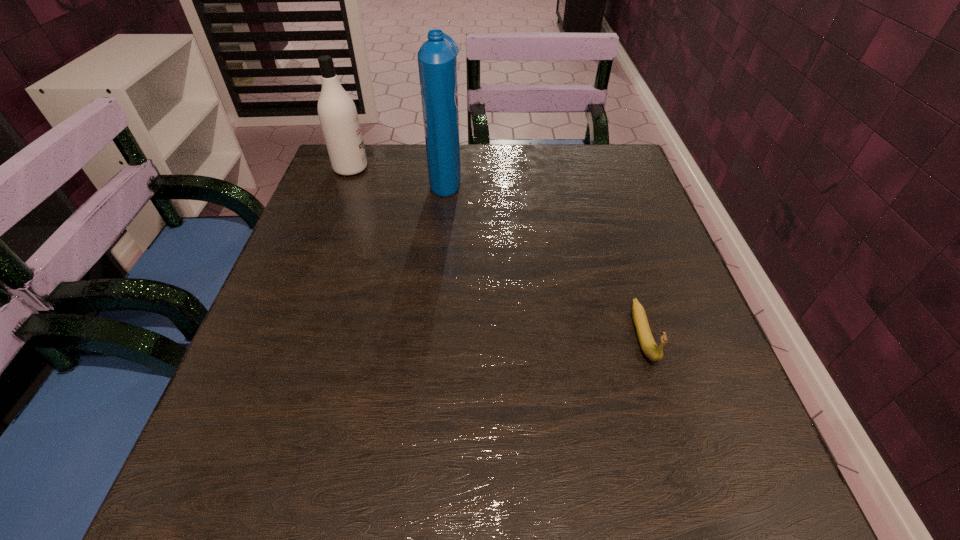
Image resolution: width=960 pixels, height=540 pixels. I want to click on the second object from left to right, so click(437, 62).

Where is `the right shampoo`? the right shampoo is located at coordinates (437, 62).

The image size is (960, 540). I want to click on the shorter shampoo, so click(x=338, y=116).

This screenshot has width=960, height=540. Identify the location of the left shampoo. (338, 116).

Locate an element on the screen. the rightmost object is located at coordinates (653, 352).

Locate an element on the screen. The height and width of the screenshot is (540, 960). the shortest object is located at coordinates (653, 352).

The height and width of the screenshot is (540, 960). Find the location of `blank space located 0.280m on the right of the tallest object`. blank space located 0.280m on the right of the tallest object is located at coordinates (572, 174).

At what (x,y) coordinates should I click in order to perform the action: click on blank space located on the front-facing side of the shorter shampoo. Please return your answer as a coordinate pair (x, y). This screenshot has height=540, width=960. Looking at the image, I should click on (484, 168).

The image size is (960, 540). Identify the location of blank space located 0.100m at the stem of the banana. (672, 428).

Where is `object present at the left edge`? object present at the left edge is located at coordinates (338, 116).